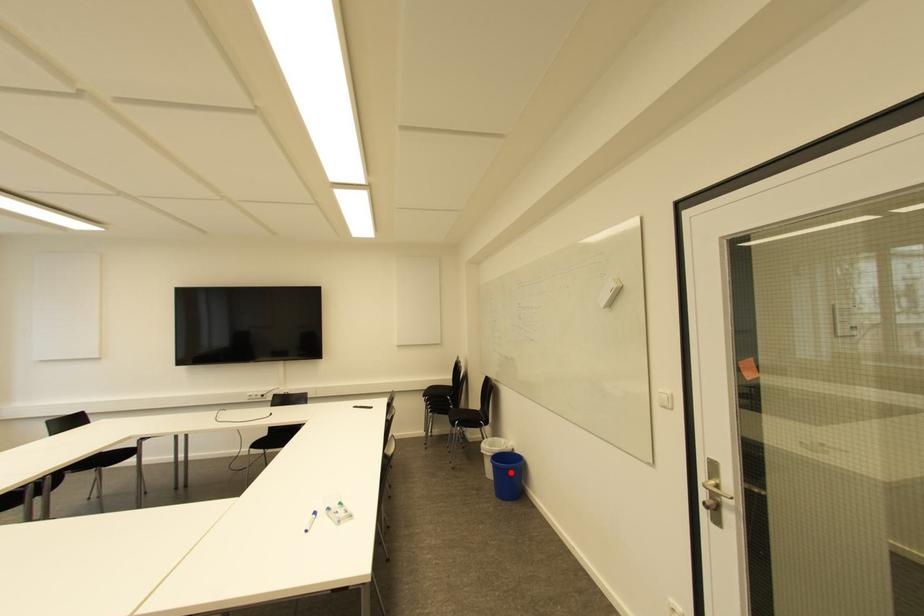
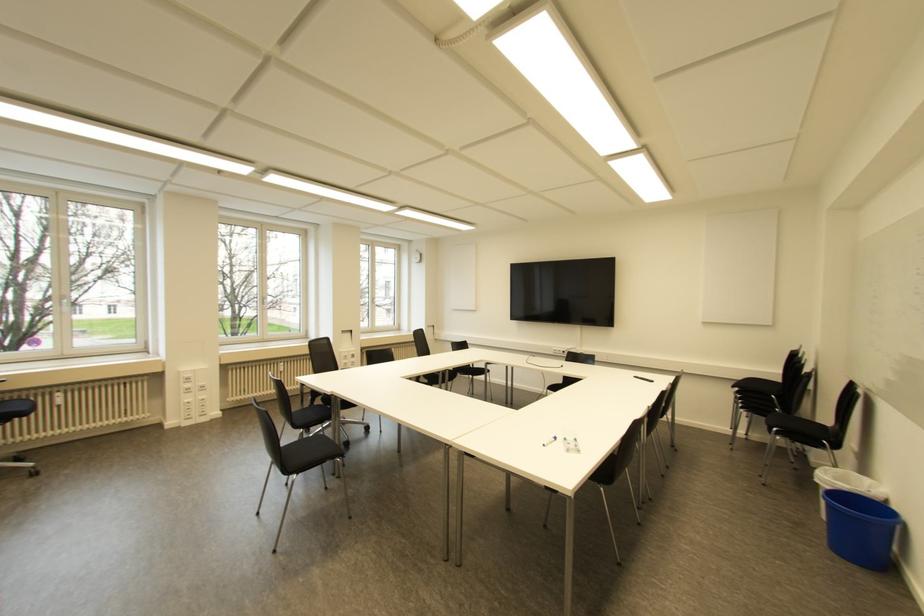
The point at the highlighted location is marked in the first image. Where is the corresponding point in the second image?

(864, 527)